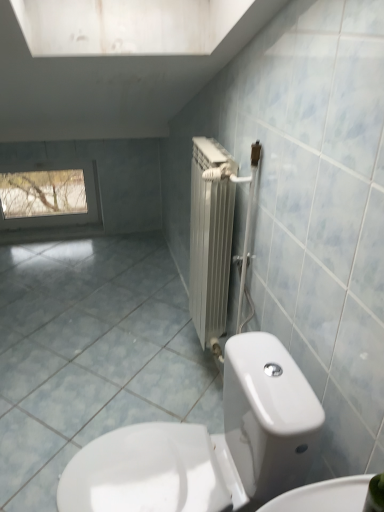
The width and height of the screenshot is (384, 512). Identify the location of blank space above blue glossy tile at center (from a real-world perspective). (108, 324).